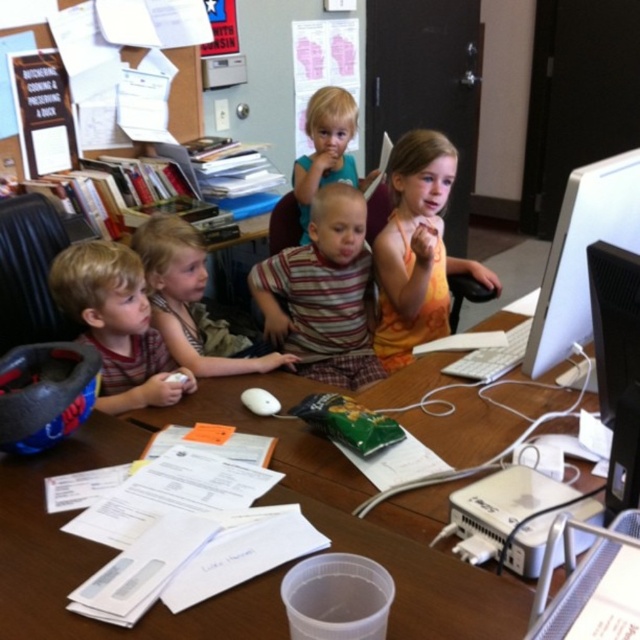
You are a photographer standing in front of the clear plastic cup at center. You want to take a photo of the cup with the camera. Can you reach the camera from your current position without moving the cup?

The clear plastic cup at center and camera are 30.00 inches apart from each other. Since you are standing in front of the cup, you would need to move 30 inches to reach the camera, so you can reach it without moving the cup as long as you can extend your arm that far.